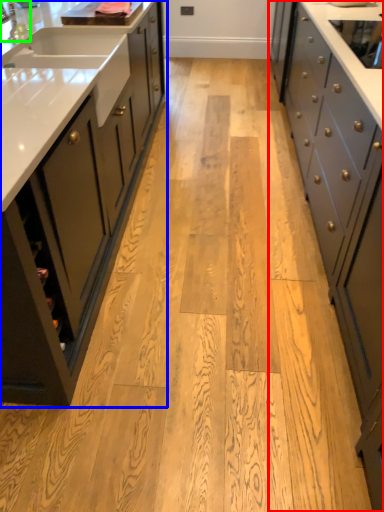
Question: Considering the real-world distances, which object is farthest from cabinetry (highlighted by a red box)? cabinetry (highlighted by a blue box) or faucet (highlighted by a green box)?

Choices:
 (A) cabinetry
 (B) faucet

Answer: (B)